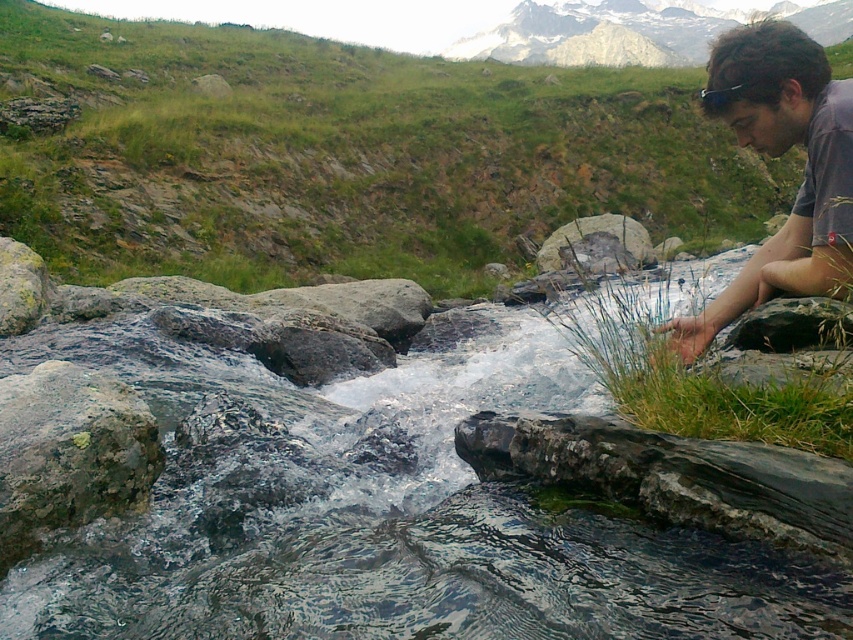
Question: Can you confirm if green grass at right is positioned below smooth gray rock at center?

Choices:
 (A) no
 (B) yes

Answer: (B)

Question: Which of these objects is positioned closest to the green grassy hillside at upper left?

Choices:
 (A) dark gray t-shirt at right
 (B) green mossy rock at left

Answer: (A)

Question: Which of the following is the closest to the observer?

Choices:
 (A) (128, 186)
 (B) (844, 387)

Answer: (B)

Question: Considering the real-world distances, which object is closest to the green grass at right?

Choices:
 (A) clear water at center
 (B) smooth gray rock at center
 (C) green mossy rock at left
 (D) green grassy hillside at upper left

Answer: (A)

Question: Considering the relative positions of green grassy hillside at upper left and green grass at right in the image provided, where is green grassy hillside at upper left located with respect to green grass at right?

Choices:
 (A) right
 (B) left

Answer: (B)

Question: Can you confirm if dark gray t-shirt at right is smaller than smooth gray rock at center?

Choices:
 (A) yes
 (B) no

Answer: (B)